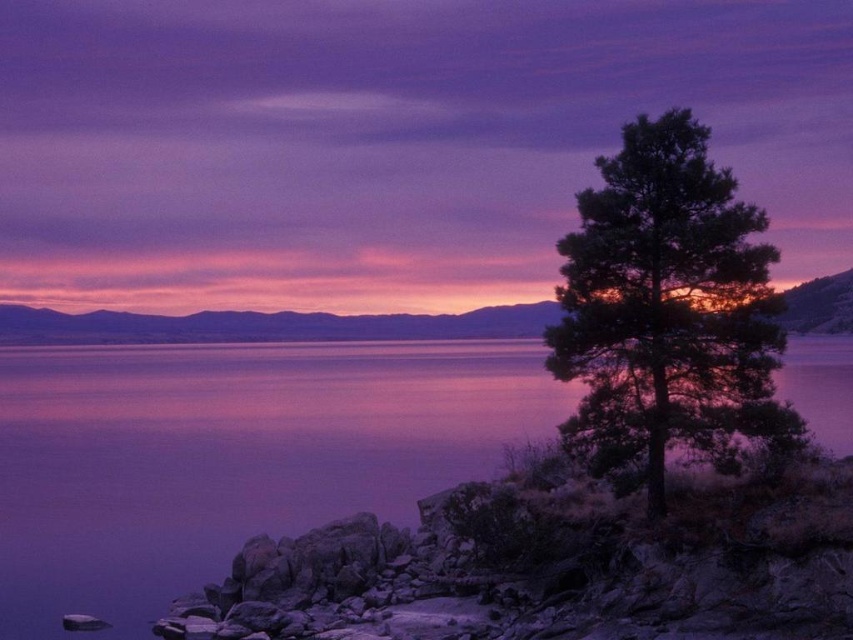
Between purple smooth water at center and dark green textured tree at right, which one appears on the right side from the viewer's perspective?

dark green textured tree at right

Does purple smooth water at center appear under dark green textured tree at right?

Yes.

Is point (61, 484) farther from camera compared to point (656, 451)?

Yes, it is behind point (656, 451).

You are a GUI agent. You are given a task and a screenshot of the screen. Output one action in this format:
    pyautogui.click(x=<x>, y=<y>)
    Task: Click on the purple smooth water at center
    This screenshot has height=640, width=853.
    Given the screenshot: What is the action you would take?
    pyautogui.click(x=229, y=451)